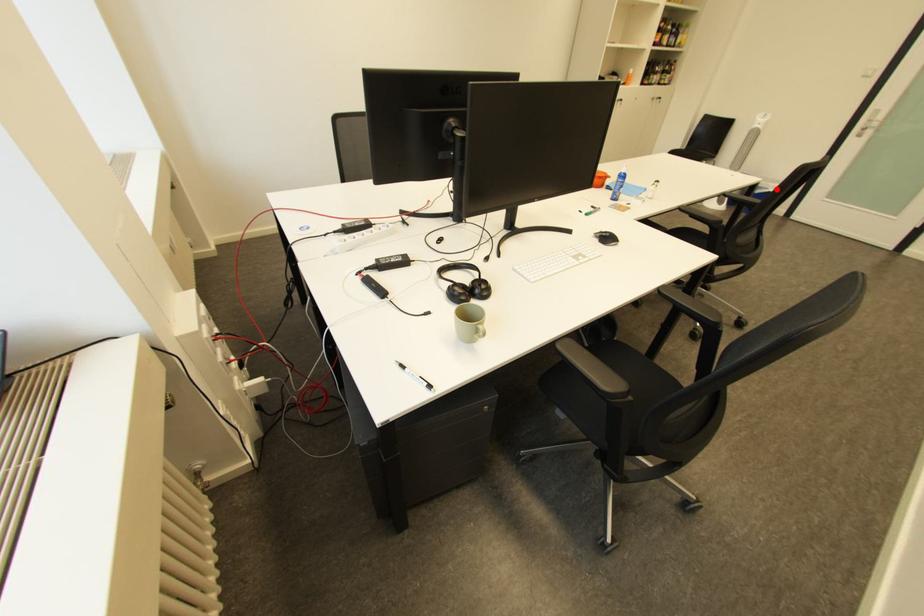
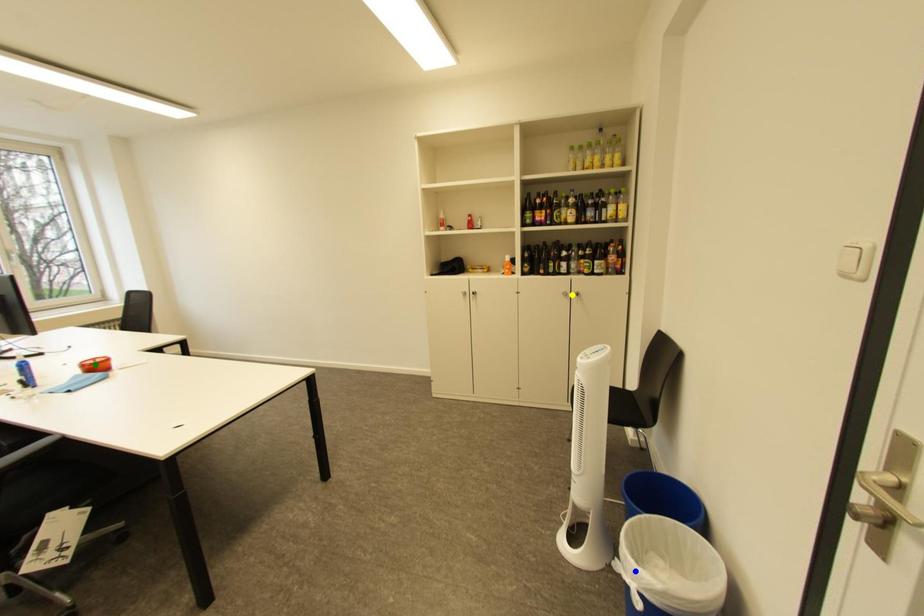
Question: I am providing you with two images of the same scene from different viewpoints. A red point is marked on the first image. You are given multiple points on the second image. Which point in image 2 is actually the same real-world point as the red point in image 1?

Choices:
 (A) yellow point
 (B) blue point
 (C) green point

Answer: (B)